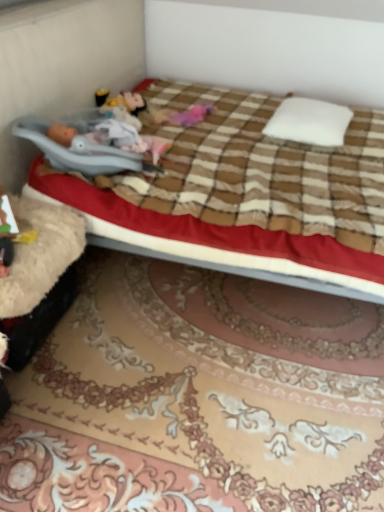
Question: Is white soft pillow at center inside the boundaries of pink fabric doll at center, or outside?

Choices:
 (A) outside
 (B) inside

Answer: (A)

Question: Is white soft pillow at center taller or shorter than pink fabric doll at center?

Choices:
 (A) short
 (B) tall

Answer: (A)

Question: Estimate the real-world distances between objects in this image. Which object is closer to the brown plaid blanket at center?

Choices:
 (A) white soft pillow at center
 (B) pink fabric doll at center

Answer: (A)

Question: Considering the real-world distances, which object is closest to the brown plaid blanket at center?

Choices:
 (A) white soft pillow at center
 (B) pink fabric doll at center

Answer: (A)